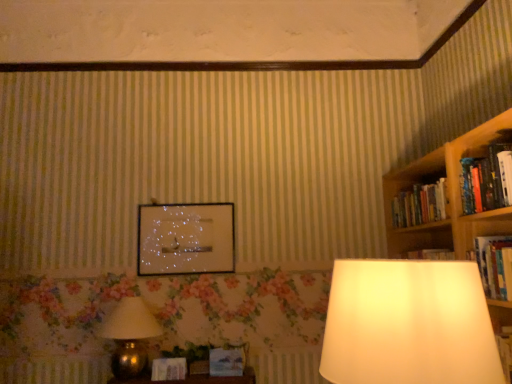
This screenshot has height=384, width=512. In order to click on glossy glass picture frame at center in this screenshot , I will do `click(185, 239)`.

This screenshot has width=512, height=384. What are the coordinates of `gold metallic lamp at lower left` in the screenshot? It's located at (129, 337).

What do you see at coordinates (169, 369) in the screenshot?
I see `matte brown book at lower center, which appears as the 2th paperback book when viewed from the right` at bounding box center [169, 369].

You are a GUI agent. You are given a task and a screenshot of the screen. Output one action in this format:
    pyautogui.click(x=<x>, y=<y>)
    Task: Click on the hardcover book at upper right, which is the second book from bottom to top
    This screenshot has height=384, width=512.
    Given the screenshot: What is the action you would take?
    pyautogui.click(x=487, y=180)

Can you tell me how much matte brown book at lower center, which appears as the 2th paperback book when viewed from the right, and glossy glass picture frame at center differ in facing direction?

They differ by 4.6 degrees in their facing directions.

Considering the positions of objects matte brown book at lower center, marked as the 1th paperback book in a left-to-right arrangement, and glossy glass picture frame at center in the image provided, who is more to the right, matte brown book at lower center, marked as the 1th paperback book in a left-to-right arrangement, or glossy glass picture frame at center?

glossy glass picture frame at center is more to the right.

Relative to glossy glass picture frame at center, is matte brown book at lower center, which appears as the 2th paperback book when viewed from the right, in front or behind?

Clearly, matte brown book at lower center, which appears as the 2th paperback book when viewed from the right, is in front of glossy glass picture frame at center.

From a real-world perspective, is matte brown book at lower center, which appears as the 2th paperback book when viewed from the right, positioned under glossy glass picture frame at center based on gravity?

Correct, in the physical world, matte brown book at lower center, which appears as the 2th paperback book when viewed from the right, is lower than glossy glass picture frame at center.

Is matte blue paperback book at center, acting as the second paperback book starting from the left, facing towards wooden bookshelf at right?

No.

Considering the relative positions of matte blue paperback book at center, acting as the second paperback book starting from the left, and wooden bookshelf at right in the image provided, is matte blue paperback book at center, acting as the second paperback book starting from the left, to the left or to the right of wooden bookshelf at right?

Clearly, matte blue paperback book at center, acting as the second paperback book starting from the left, is on the left of wooden bookshelf at right in the image.

From a real-world perspective, which is physically above, matte blue paperback book at center, the first paperback book positioned from the right, or wooden bookshelf at right?

From a 3D spatial view, wooden bookshelf at right is above.

Where is `shelf lying above the glossy glass picture frame at center (from the image's perspective)`? This screenshot has height=384, width=512. shelf lying above the glossy glass picture frame at center (from the image's perspective) is located at coordinates (417, 192).

Between glossy glass picture frame at center and wooden bookshelf at right, which one has smaller width?

glossy glass picture frame at center.

From a real-world perspective, which object stands above the other?

wooden bookshelf at right is physically above.

Is glossy glass picture frame at center taller or shorter than wooden bookshelf at right?

In the image, glossy glass picture frame at center appears to be taller than wooden bookshelf at right.

Is matte brown book at lower center, which appears as the 2th paperback book when viewed from the right, bigger than hardcover book at upper right, which is the second book from bottom to top?

Actually, matte brown book at lower center, which appears as the 2th paperback book when viewed from the right, might be smaller than hardcover book at upper right, which is the second book from bottom to top.

Is the depth of matte brown book at lower center, which appears as the 2th paperback book when viewed from the right, less than that of hardcover book at upper right, placed as the 1th book when sorted from top to bottom?

No, the depth of matte brown book at lower center, which appears as the 2th paperback book when viewed from the right, is greater than that of hardcover book at upper right, placed as the 1th book when sorted from top to bottom.

Is matte brown book at lower center, which appears as the 2th paperback book when viewed from the right, located outside hardcover book at upper right, placed as the 1th book when sorted from top to bottom?

Yes.

Identify the location of shelf located above the hardcover book at right, the 1th book positioned from the bottom (from the image's perspective). The height and width of the screenshot is (384, 512). (417, 192).

Considering their positions, is wooden bookshelf at right located in front of or behind hardcover book at right, arranged as the 2th book when viewed from the top?

wooden bookshelf at right is positioned farther from the viewer than hardcover book at right, arranged as the 2th book when viewed from the top.

In terms of size, does wooden bookshelf at right appear bigger or smaller than hardcover book at right, the 1th book positioned from the bottom?

In the image, wooden bookshelf at right appears to be larger than hardcover book at right, the 1th book positioned from the bottom.

Would you consider hardcover book at right, the 1th book positioned from the bottom, to be distant from wooden bookshelf at right?

hardcover book at right, the 1th book positioned from the bottom, is near wooden bookshelf at right, not far away.

Is hardcover book at right, the 1th book positioned from the bottom, at the right side of wooden bookshelf at right?

Yes.

Is point (492, 240) closer or farther from the camera than point (418, 184)?

Point (492, 240).

Considering the relative sizes of hardcover book at right, arranged as the 2th book when viewed from the top, and wooden bookshelf at right in the image provided, is hardcover book at right, arranged as the 2th book when viewed from the top, bigger than wooden bookshelf at right?

No.

Considering the sizes of objects wooden bookshelf at right and gold metallic lamp at lower left in the image provided, who is bigger, wooden bookshelf at right or gold metallic lamp at lower left?

gold metallic lamp at lower left is bigger.

Which is more to the right, wooden bookshelf at right or gold metallic lamp at lower left?

From the viewer's perspective, wooden bookshelf at right appears more on the right side.

Considering the sizes of objects wooden bookshelf at right and gold metallic lamp at lower left in the image provided, who is taller, wooden bookshelf at right or gold metallic lamp at lower left?

With more height is gold metallic lamp at lower left.

The height and width of the screenshot is (384, 512). I want to click on picture frame lying behind the matte brown book at lower center, which appears as the 2th paperback book when viewed from the right, so [x=185, y=239].

The height and width of the screenshot is (384, 512). I want to click on shelf above the matte blue paperback book at center, acting as the second paperback book starting from the left (from the image's perspective), so click(x=417, y=192).

Estimate the real-world distances between objects in this image. Which object is closer to gold metallic lamp at lower left, wooden bookshelf at right or glossy glass picture frame at center?

Based on the image, glossy glass picture frame at center appears to be nearer to gold metallic lamp at lower left.

From the image, which object appears to be nearer to matte brown book at lower center, marked as the 1th paperback book in a left-to-right arrangement, hardcover book at upper right, which is the second book from bottom to top, or hardcover book at right, the 1th book positioned from the bottom?

Among the two, hardcover book at right, the 1th book positioned from the bottom, is located nearer to matte brown book at lower center, marked as the 1th paperback book in a left-to-right arrangement.

From the image, which object appears to be farther from glossy glass picture frame at center, gold metallic lamp at lower left or matte brown book at lower center, which appears as the 2th paperback book when viewed from the right?

matte brown book at lower center, which appears as the 2th paperback book when viewed from the right, is positioned further to the anchor glossy glass picture frame at center.

In the scene shown: Which object lies nearer to the anchor point wooden bookshelf at right, matte blue paperback book at center, the first paperback book positioned from the right, or glossy glass picture frame at center?

glossy glass picture frame at center is closer to wooden bookshelf at right.

Based on their spatial positions, is gold metallic lamp at lower left or matte blue paperback book at center, the first paperback book positioned from the right, further from glossy glass picture frame at center?

Based on the image, matte blue paperback book at center, the first paperback book positioned from the right, appears to be further to glossy glass picture frame at center.

Estimate the real-world distances between objects in this image. Which object is further from gold metallic lamp at lower left, matte brown book at lower center, which appears as the 2th paperback book when viewed from the right, or glossy glass picture frame at center?

glossy glass picture frame at center.

When comparing their distances from glossy glass picture frame at center, does gold metallic lamp at lower left or hardcover book at right, arranged as the 2th book when viewed from the top, seem further?

Among the two, hardcover book at right, arranged as the 2th book when viewed from the top, is located further to glossy glass picture frame at center.

When comparing their distances from matte blue paperback book at center, acting as the second paperback book starting from the left, does gold metallic lamp at lower left or matte brown book at lower center, which appears as the 2th paperback book when viewed from the right, seem further?

gold metallic lamp at lower left lies further to matte blue paperback book at center, acting as the second paperback book starting from the left, than the other object.

Find the location of a particular element. The height and width of the screenshot is (384, 512). book between matte blue paperback book at center, the first paperback book positioned from the right, and hardcover book at upper right, which is the second book from bottom to top, from left to right is located at coordinates (492, 264).

Image resolution: width=512 pixels, height=384 pixels. Identify the location of paperback book between glossy glass picture frame at center and hardcover book at right, the 1th book positioned from the bottom. (226, 362).

Locate an element on the screen. shelf between matte brown book at lower center, marked as the 1th paperback book in a left-to-right arrangement, and hardcover book at right, arranged as the 2th book when viewed from the top, from left to right is located at coordinates (417, 192).

This screenshot has height=384, width=512. In order to click on shelf situated between glossy glass picture frame at center and hardcover book at upper right, placed as the 1th book when sorted from top to bottom, from left to right in this screenshot , I will do `click(417, 192)`.